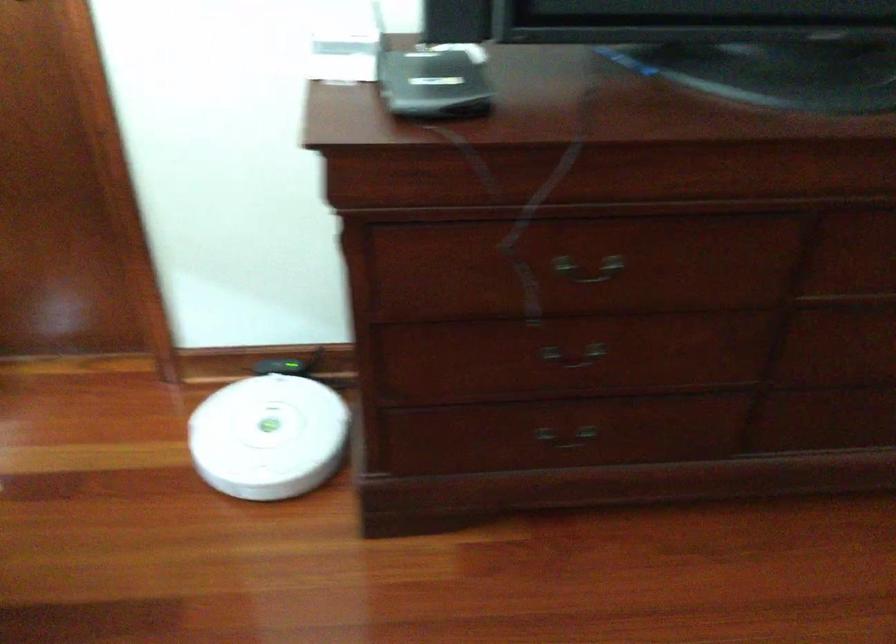
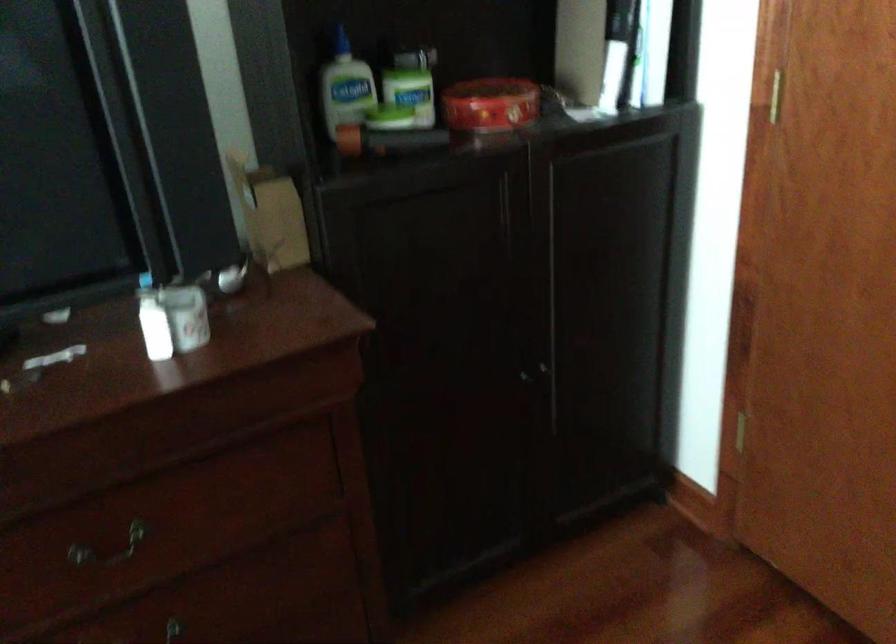
Question: How did the camera likely rotate?

Choices:
 (A) Left
 (B) Right
 (C) Up
 (D) Down

Answer: (B)